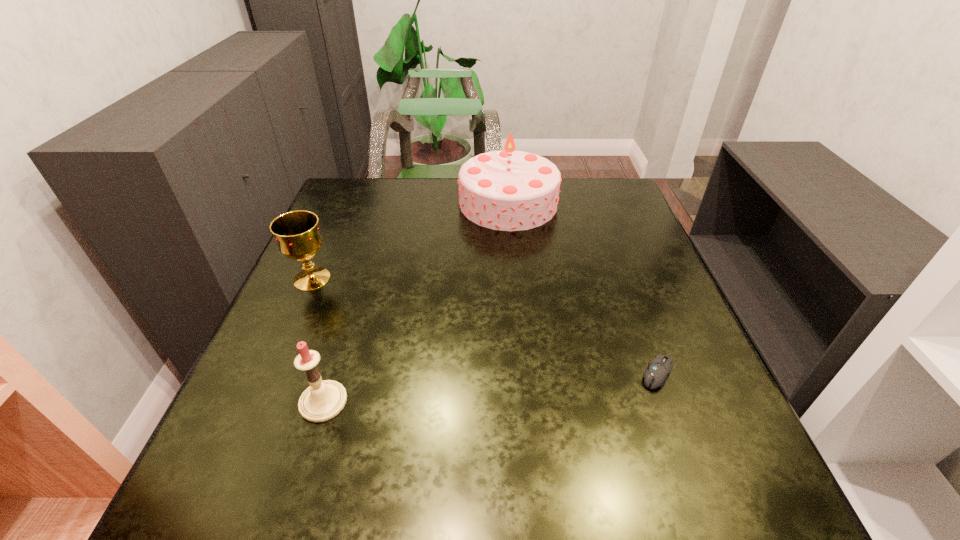
Identify which object is the third closest to the farthest object. Please provide its 2D coordinates. Your answer should be formatted as a tuple, i.e. [(x, y)], where the tuple contains the x and y coordinates of a point satisfying the conditions above.

[(322, 400)]

You are a GUI agent. You are given a task and a screenshot of the screen. Output one action in this format:
    pyautogui.click(x=<x>, y=<y>)
    Task: Click on the blank area in the image that satisfies the following two spatial constraints: 1. on the back side of the leftmost object; 2. on the right side of the third object from left to right
    
    Given the screenshot: What is the action you would take?
    pyautogui.click(x=345, y=203)

I want to click on vacant area that satisfies the following two spatial constraints: 1. on the back side of the second object from left to right; 2. on the right side of the computer mouse, so click(332, 373).

The width and height of the screenshot is (960, 540). What are the coordinates of `vacant point that satisfies the following two spatial constraints: 1. on the back side of the second object from right to left; 2. on the left side of the third object from right to left` in the screenshot? It's located at (384, 203).

Identify the location of free space that satisfies the following two spatial constraints: 1. on the front side of the tallest object; 2. on the left side of the shortest object. (524, 373).